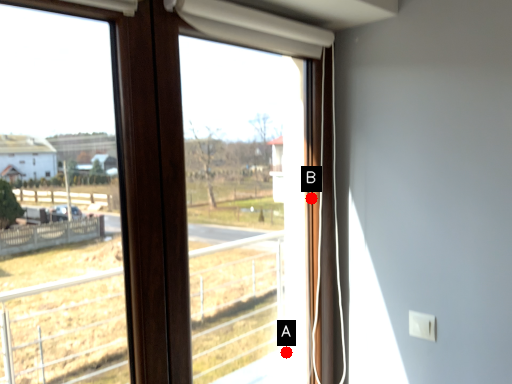
Question: Two points are circled on the image, labeled by A and B beside each circle. Which point is closer to the camera taking this photo?

Choices:
 (A) A is closer
 (B) B is closer

Answer: (B)